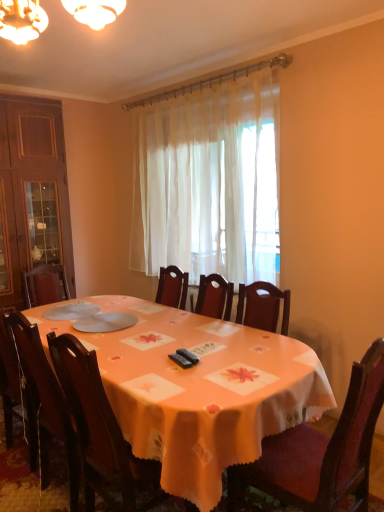
Question: Can you confirm if orange fabric table at center is thinner than wooden chair at center, the second chair when ordered from right to left?

Choices:
 (A) yes
 (B) no

Answer: (B)

Question: Can you confirm if orange fabric table at center is bigger than wooden chair at center, acting as the 2th chair starting from the left?

Choices:
 (A) yes
 (B) no

Answer: (A)

Question: Is orange fabric table at center touching wooden chair at center, acting as the 2th chair starting from the left?

Choices:
 (A) yes
 (B) no

Answer: (B)

Question: From a real-world perspective, is orange fabric table at center located beneath wooden chair at center, the second chair when ordered from right to left?

Choices:
 (A) no
 (B) yes

Answer: (B)

Question: Is orange fabric table at center positioned before wooden chair at center, the second chair when ordered from right to left?

Choices:
 (A) yes
 (B) no

Answer: (A)

Question: Is point (56, 312) positioned closer to the camera than point (44, 474)?

Choices:
 (A) farther
 (B) closer

Answer: (A)

Question: Looking at their shapes, would you say white matte plates at center is wider or thinner than dark wood chair at lower left, the third chair in the right-to-left sequence?

Choices:
 (A) wide
 (B) thin

Answer: (B)

Question: Choose the correct answer: Is white matte plates at center inside dark wood chair at lower left, the third chair in the right-to-left sequence, or outside it?

Choices:
 (A) outside
 (B) inside

Answer: (A)

Question: Looking at the image, does white matte plates at center seem bigger or smaller compared to dark wood chair at lower left, which ranks as the 1th chair in left-to-right order?

Choices:
 (A) big
 (B) small

Answer: (B)

Question: Is white matte plates at center inside or outside of orange fabric table at center?

Choices:
 (A) outside
 (B) inside

Answer: (B)

Question: In the image, is white matte plates at center on the left side or the right side of orange fabric table at center?

Choices:
 (A) left
 (B) right

Answer: (A)

Question: Is white matte plates at center taller or shorter than orange fabric table at center?

Choices:
 (A) short
 (B) tall

Answer: (A)

Question: From a real-world perspective, relative to orange fabric table at center, is white matte plates at center vertically above or below?

Choices:
 (A) below
 (B) above

Answer: (B)

Question: Is sheer white curtain at center in front of or behind wooden chair at lower right, which is counted as the first chair, starting from the right, in the image?

Choices:
 (A) front
 (B) behind

Answer: (B)

Question: Is sheer white curtain at center to the left or to the right of wooden chair at lower right, which is counted as the first chair, starting from the right, in the image?

Choices:
 (A) left
 (B) right

Answer: (A)